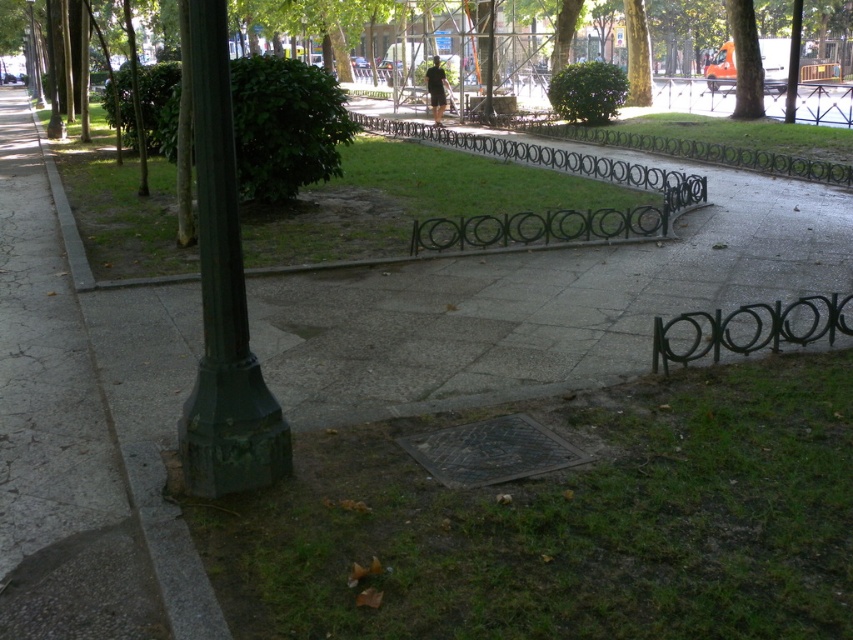
At what (x,y) coordinates should I click in order to perform the action: click on green grass at lower center. Please return your answer as a coordinate pair (x, y). Image resolution: width=853 pixels, height=640 pixels. Looking at the image, I should click on (567, 522).

Which of these two, green grass at lower center or green grass at center, stands shorter?

Standing shorter between the two is green grass at lower center.

Is point (811, 380) closer to viewer compared to point (360, 179)?

Yes, it is.

I want to click on green grass at lower center, so click(x=567, y=522).

The image size is (853, 640). What are the coordinates of `green grass at lower center` in the screenshot? It's located at (567, 522).

Between point (741, 600) and point (752, 10), which one is positioned in front?

Point (741, 600) is more forward.

You are a GUI agent. You are given a task and a screenshot of the screen. Output one action in this format:
    pyautogui.click(x=<x>, y=<y>)
    Task: Click on the green grass at lower center
    
    Given the screenshot: What is the action you would take?
    pyautogui.click(x=567, y=522)

Describe the element at coordinates (223, 298) in the screenshot. This screenshot has width=853, height=640. I see `green matte pole at left` at that location.

Does green matte pole at left appear on the right side of green leafy tree at upper right?

No, green matte pole at left is not to the right of green leafy tree at upper right.

Which is behind, point (236, 488) or point (741, 65)?

The point (741, 65) is behind.

This screenshot has height=640, width=853. Find the location of `green matte pole at left`. green matte pole at left is located at coordinates tap(223, 298).